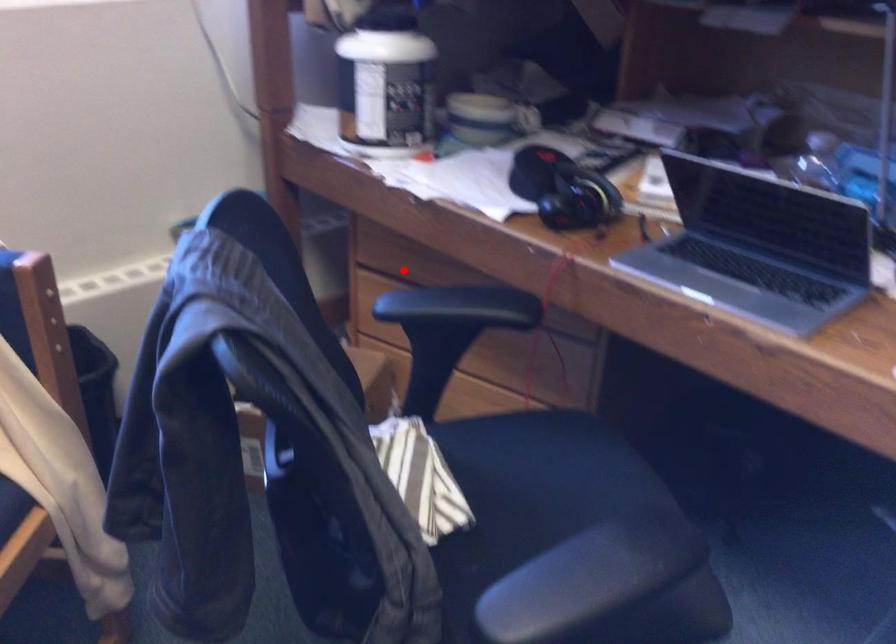
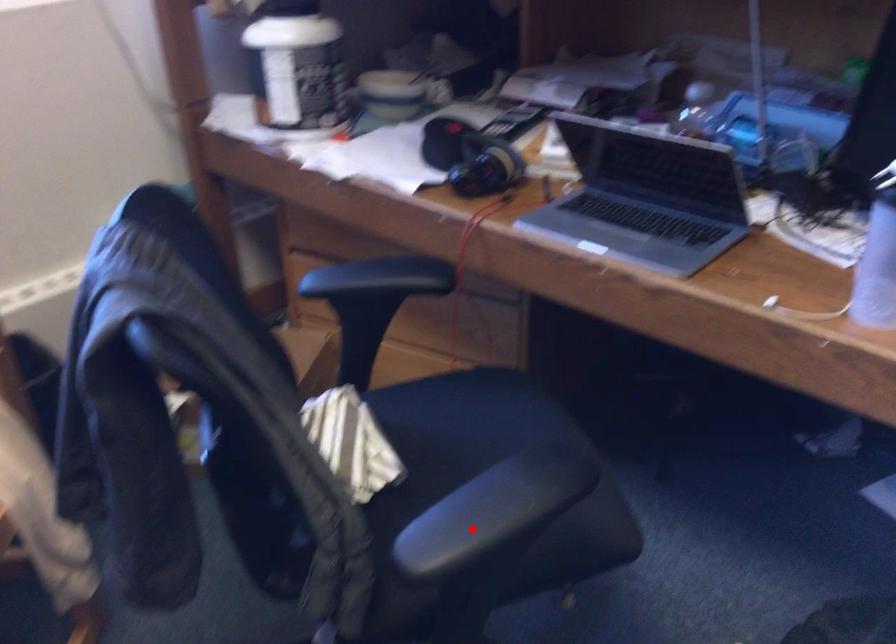
I am providing you with two images of the same scene from different viewpoints. A red point is marked on the first image and another point is marked on the second image. Does the point marked in image1 correspond to the same location as the one in image2?

No